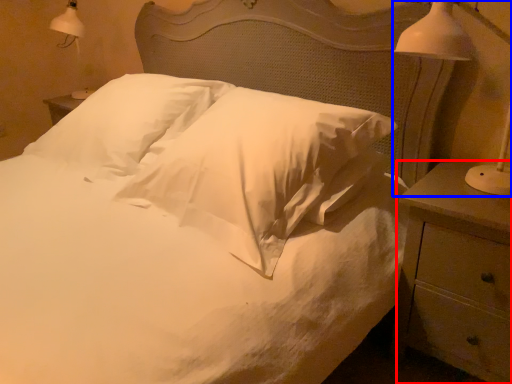
Question: Which of the following is the farthest to the observer, nightstand (highlighted by a red box) or bedside lamp (highlighted by a blue box)?

Choices:
 (A) nightstand
 (B) bedside lamp

Answer: (A)